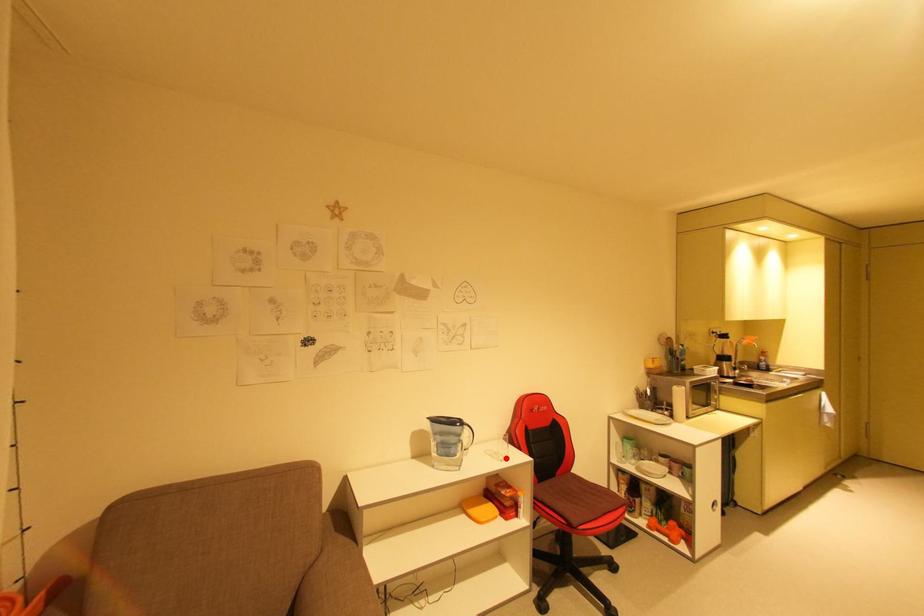
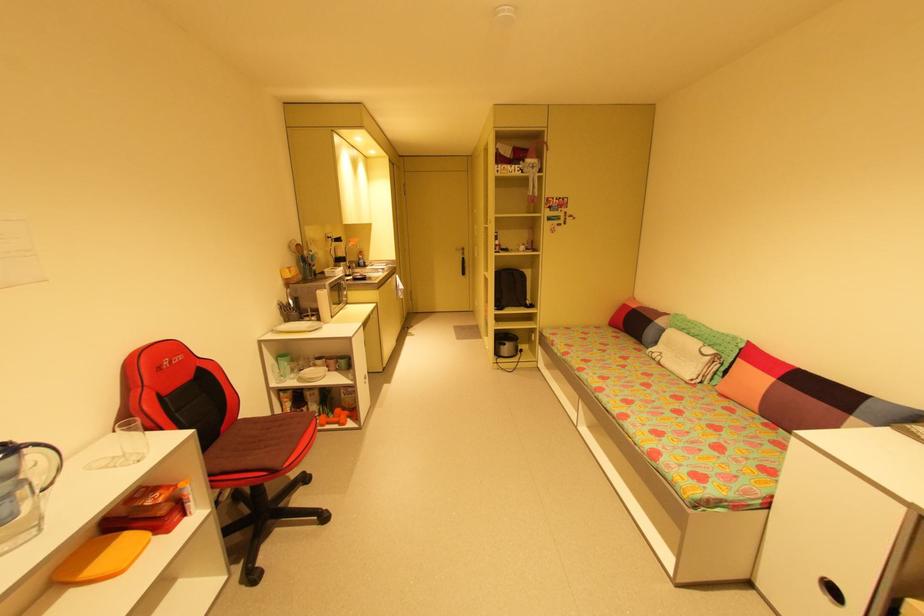
Locate, in the second image, the point that corresponds to the highlighted location in the first image.

(139, 459)